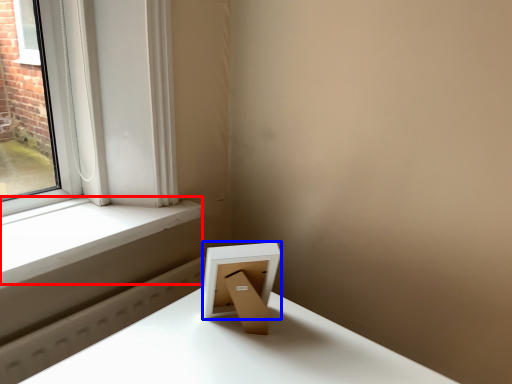
Question: Among these objects, which one is nearest to the camera, window sill (highlighted by a red box) or picture frame (highlighted by a blue box)?

Choices:
 (A) window sill
 (B) picture frame

Answer: (B)